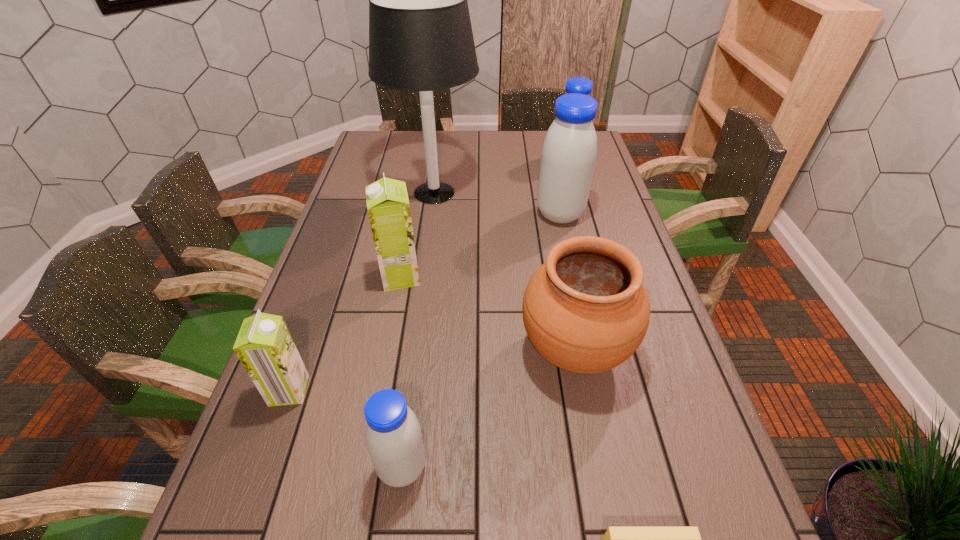
Locate an element on the screen. This screenshot has height=540, width=960. table lamp that is at the left edge is located at coordinates (420, 35).

Identify the location of soya milk that is at the left edge. This screenshot has width=960, height=540. (264, 346).

You are a GUI agent. You are given a task and a screenshot of the screen. Output one action in this format:
    pyautogui.click(x=<x>, y=<y>)
    Task: Click on the pottery located at the right edge
    The width and height of the screenshot is (960, 540).
    Given the screenshot: What is the action you would take?
    [585, 310]

The width and height of the screenshot is (960, 540). I want to click on object that is at the far right corner, so click(x=581, y=85).

Locate an element on the screen. The image size is (960, 540). free location at the far edge is located at coordinates pyautogui.click(x=516, y=131).

In the image, there is a desktop. Where is `vacant region at the left edge`? The height and width of the screenshot is (540, 960). vacant region at the left edge is located at coordinates (399, 163).

This screenshot has width=960, height=540. In the image, there is a desktop. What are the coordinates of `free region at the far left corner` in the screenshot? It's located at (401, 144).

Locate an element on the screen. The image size is (960, 540). free spot between the nearest soya milk and the left green soya milk is located at coordinates (346, 429).

Identify the location of vacant area that lies between the seventh shortest object and the farther green soya milk. The width and height of the screenshot is (960, 540). (480, 246).

Image resolution: width=960 pixels, height=540 pixels. In order to click on free space between the second smallest blue soya milk and the smaller green soya milk in this screenshot , I will do `click(428, 276)`.